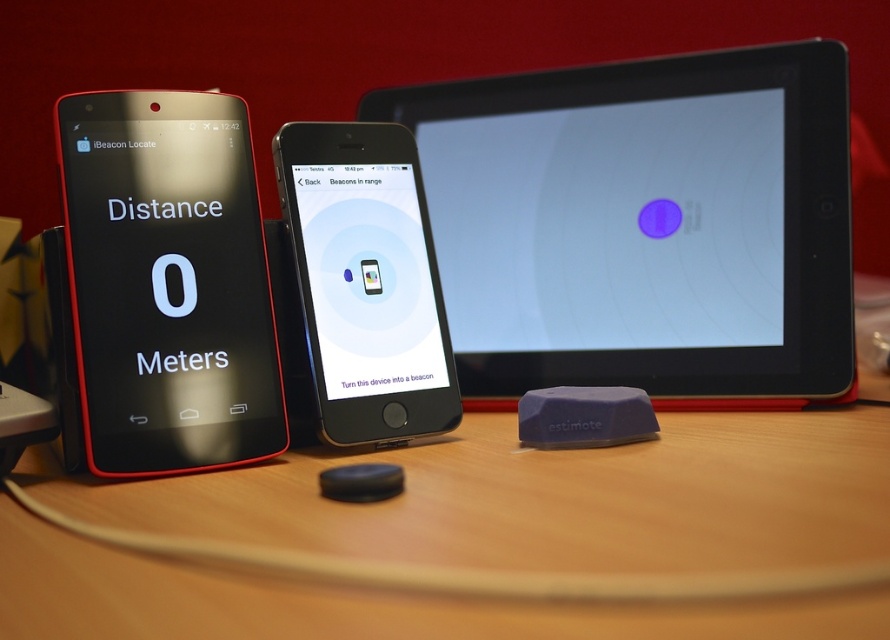
Question: Which of the following is the closest to the observer?

Choices:
 (A) wooden table at center
 (B) black glossy phone at left
 (C) matte black tablet at center
 (D) black glossy ipod touch at center

Answer: (A)

Question: Among these objects, which one is farthest from the camera?

Choices:
 (A) matte black tablet at center
 (B) black glossy phone at left
 (C) black glossy ipod touch at center
 (D) wooden table at center

Answer: (A)

Question: Which point is farther from the camera taking this photo?

Choices:
 (A) (272, 145)
 (B) (99, 381)
 (C) (790, 204)

Answer: (C)

Question: Does black glossy phone at left lie in front of black glossy ipod touch at center?

Choices:
 (A) no
 (B) yes

Answer: (B)

Question: Considering the relative positions of matte black tablet at center and black glossy ipod touch at center in the image provided, where is matte black tablet at center located with respect to black glossy ipod touch at center?

Choices:
 (A) below
 (B) above

Answer: (B)

Question: Can you confirm if matte black tablet at center is positioned below black glossy ipod touch at center?

Choices:
 (A) no
 (B) yes

Answer: (A)